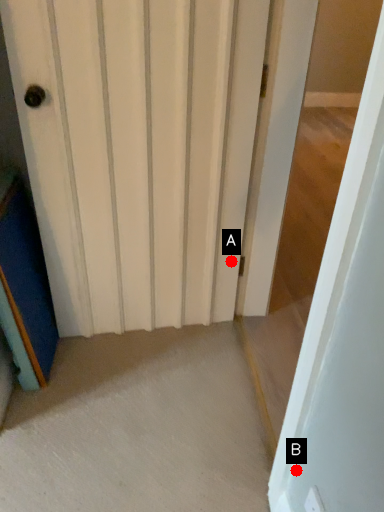
Question: Two points are circled on the image, labeled by A and B beside each circle. Which point is closer to the camera?

Choices:
 (A) A is closer
 (B) B is closer

Answer: (B)